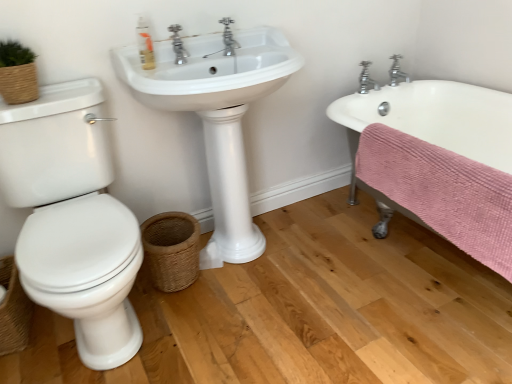
Locate an element on the screen. This screenshot has height=384, width=512. vacant area to the right of chrome metallic faucet at upper right, which appears as the 3th tap when viewed from the front is located at coordinates (437, 86).